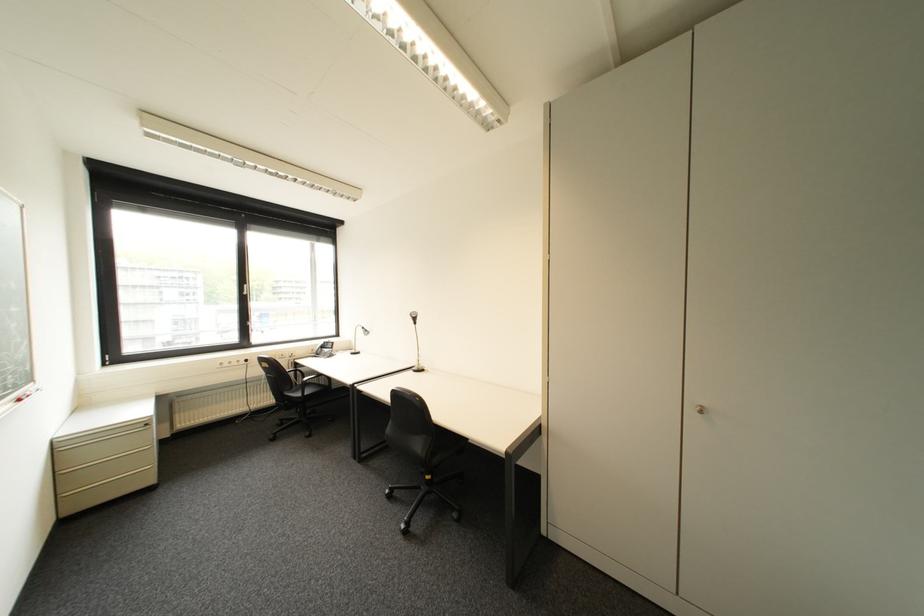
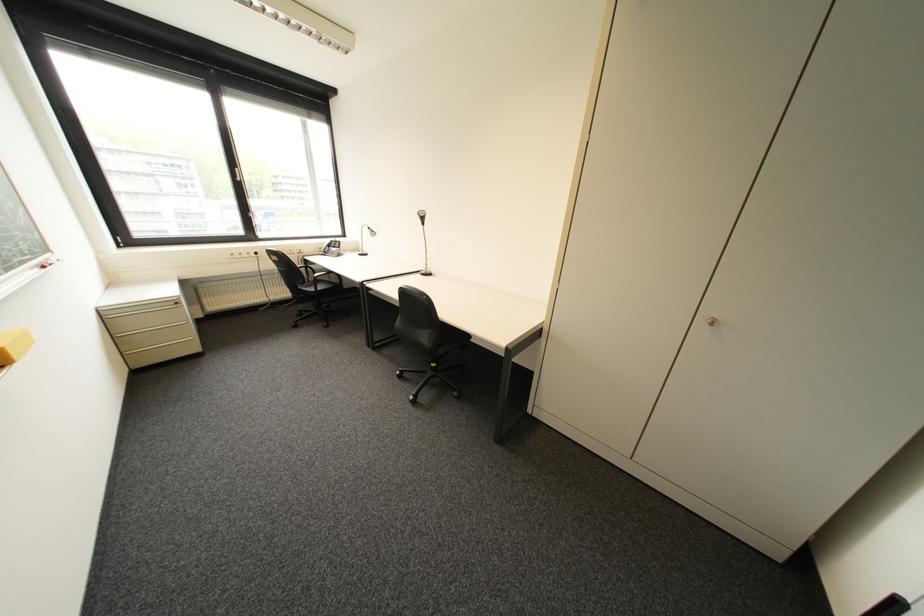
The point at (429, 446) is marked in the first image. Where is the corresponding point in the second image?

(435, 338)